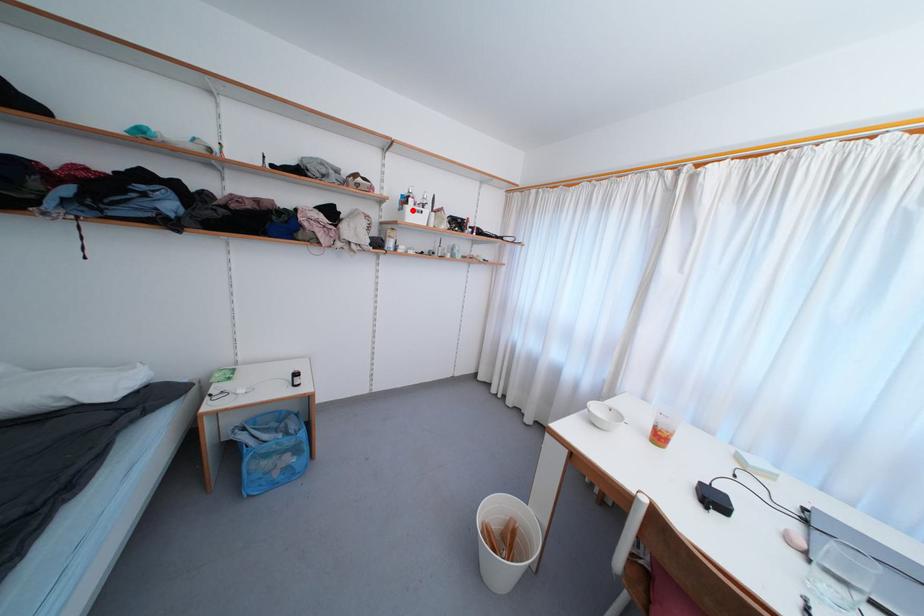
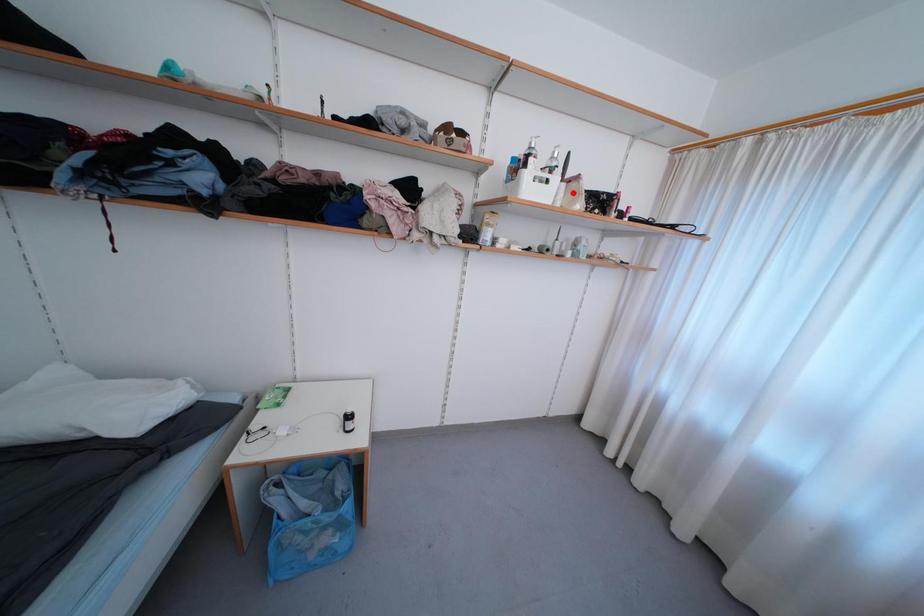
I am providing you with two images of the same scene from different viewpoints. A red point is marked on the first image and another point is marked on the second image. Is the red point in image1 aligned with the point shown in image2?

No